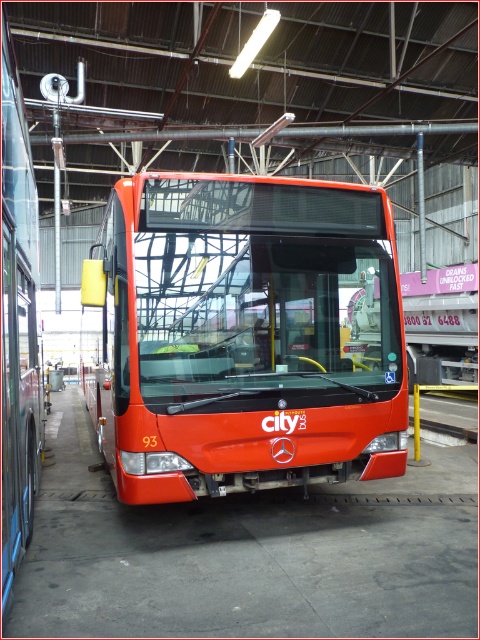
You are standing inside the bus maintenance facility and want to walk from point A to point B. Point A is at coordinate (127, 273) and point B is at coordinate (20, 477). Which point is closer to you when you start walking?

Point A at coordinate (127, 273) is closer to you because it is further to the viewer than point B at coordinate (20, 477).

You are a bus driver who needs to exit the facility. You see the shiny red bus at center and the shiny orange bus at center. Which bus is closer to the exit if the exit is at the top of the facility?

The shiny orange bus at center is closer to the exit because it is positioned above the shiny red bus at center.

You are standing at the point marked as point (358, 336) in the maintenance facility. You want to take a photo of the red city bus parked in the center. Can you fit the entire bus into your camera frame without moving? The camera has a field of view of 60 degrees horizontally and 40 degrees vertically.

The distance between the point (358, 336) and the camera is 5.05 meters. To determine if the entire bus fits in the camera frame, we need to calculate the maximum width and height the camera can capture at this distance. Using the field of view angles, the horizontal coverage would be 2 x 5.05 x tan 30 degrees, and the vertical coverage 2 x 5.05 x tan 20 degrees. If the bus dimensions are within these calculated values, it can fit. However, the exact bus dimensions aren t provided, so we can t confirm.